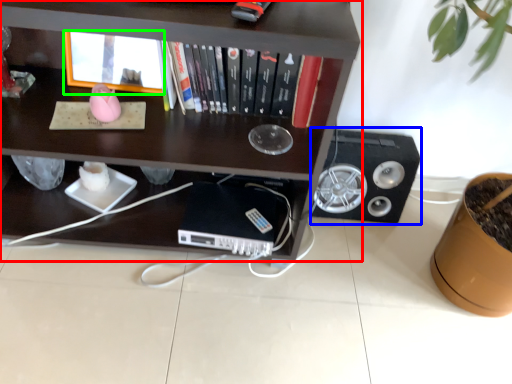
Question: Estimate the real-world distances between objects in this image. Which object is farther from shelf (highlighted by a red box), speaker (highlighted by a blue box) or shelf (highlighted by a green box)?

Choices:
 (A) speaker
 (B) shelf

Answer: (A)